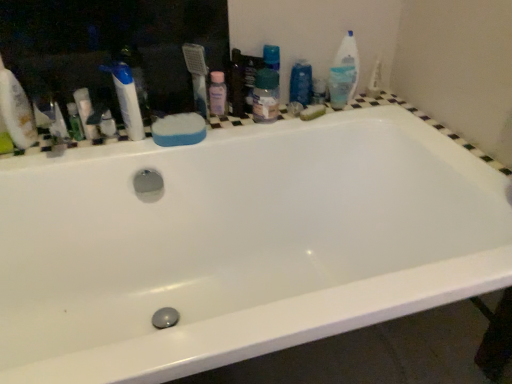
The width and height of the screenshot is (512, 384). Identify the location of unoccupied region to the right of green sponge at upper right, which appears as the first soap when viewed from the back. (354, 105).